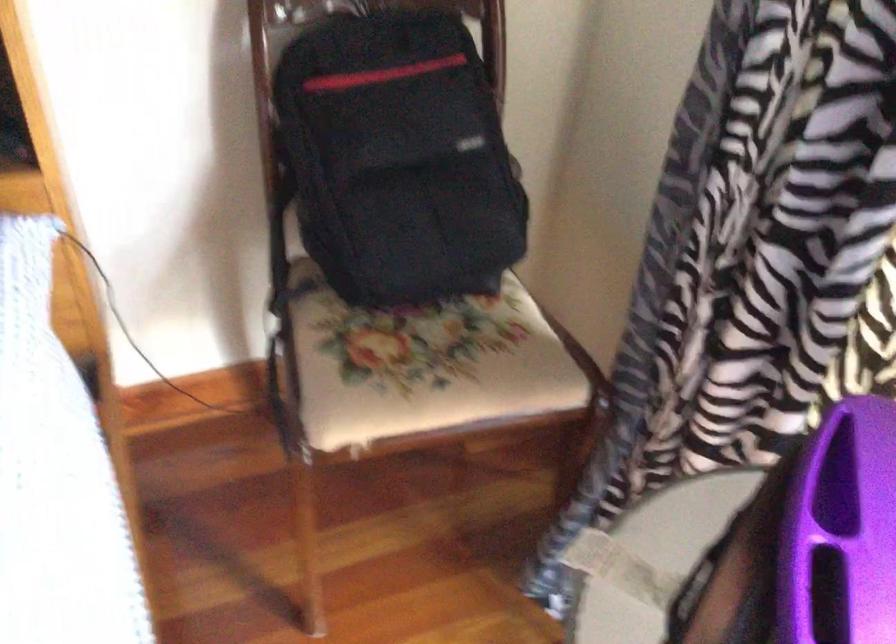
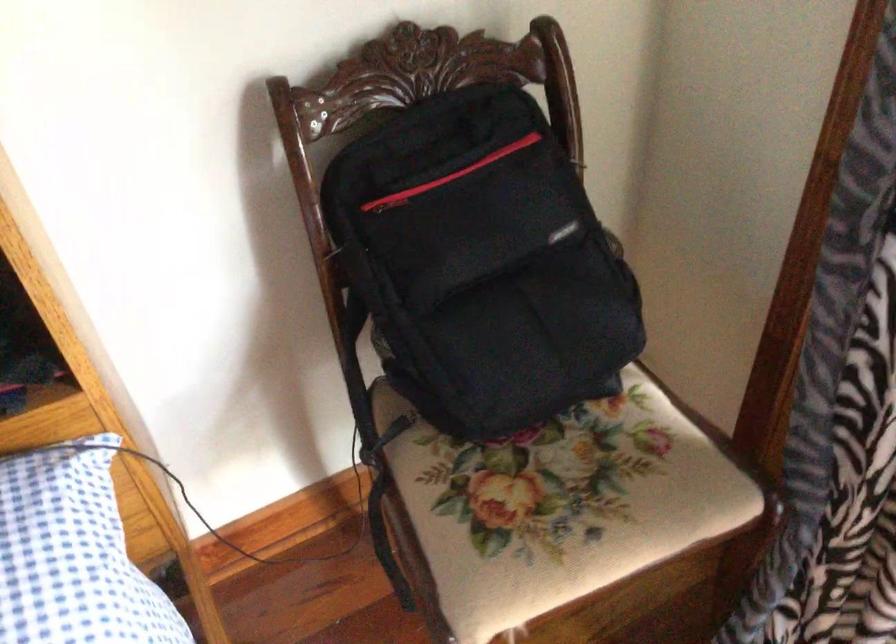
Question: Based on the continuous images, in which direction is the camera rotating? Reply with the corresponding letter.

Choices:
 (A) Left
 (B) Right
 (C) Up
 (D) Down

Answer: (D)